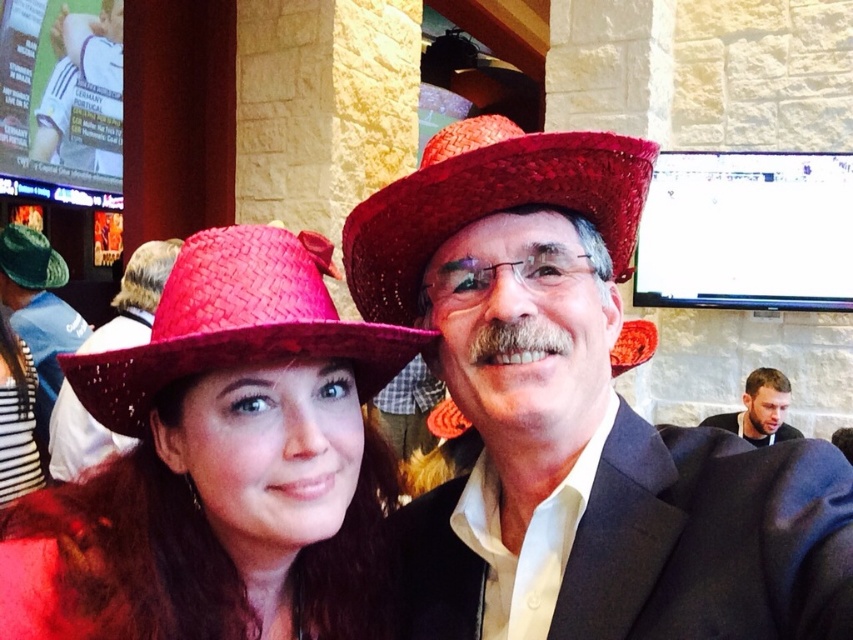
Question: Among these objects, which one is nearest to the camera?

Choices:
 (A) red woven cowboy hat at center
 (B) green felt hat at upper left
 (C) black fabric collar at lower right
 (D) bright red woven cowboy hat at center

Answer: (D)

Question: Which object is positioned closest to the red woven cowboy hat at center?

Choices:
 (A) bright red woven cowboy hat at center
 (B) matte red straw hat at center
 (C) black fabric collar at lower right

Answer: (B)

Question: Which point is closer to the camera taking this photo?

Choices:
 (A) (x=274, y=353)
 (B) (x=202, y=278)
 (C) (x=50, y=259)

Answer: (A)

Question: Is matte red straw hat at center behind green felt hat at upper left?

Choices:
 (A) yes
 (B) no

Answer: (B)

Question: Does bright red woven cowboy hat at center have a greater width compared to black fabric collar at lower right?

Choices:
 (A) yes
 (B) no

Answer: (B)

Question: Considering the relative positions of red woven cowboy hat at center and black fabric collar at lower right in the image provided, where is red woven cowboy hat at center located with respect to black fabric collar at lower right?

Choices:
 (A) below
 (B) above

Answer: (B)